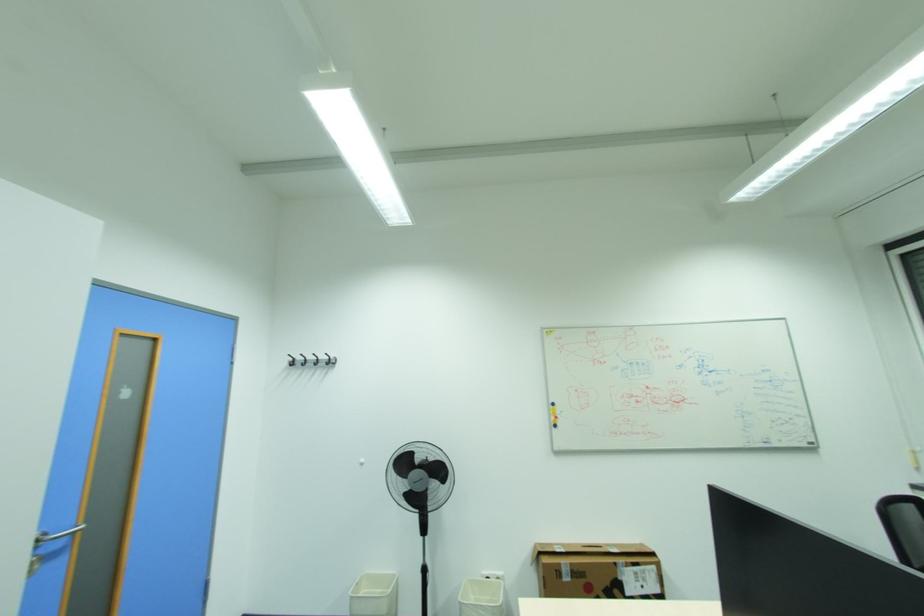
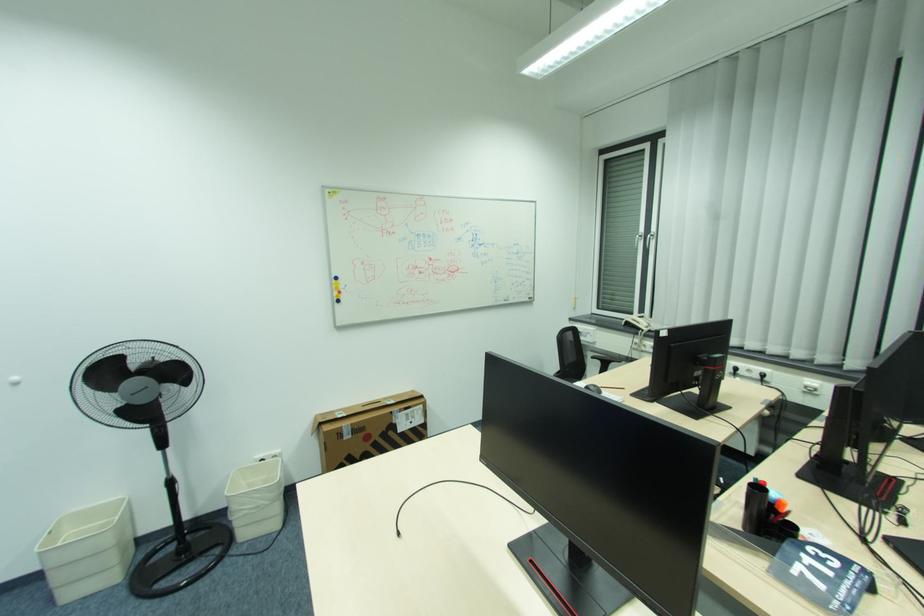
Locate, in the second image, the point that corresponds to pixel 558 419 in the first image.

(341, 294)